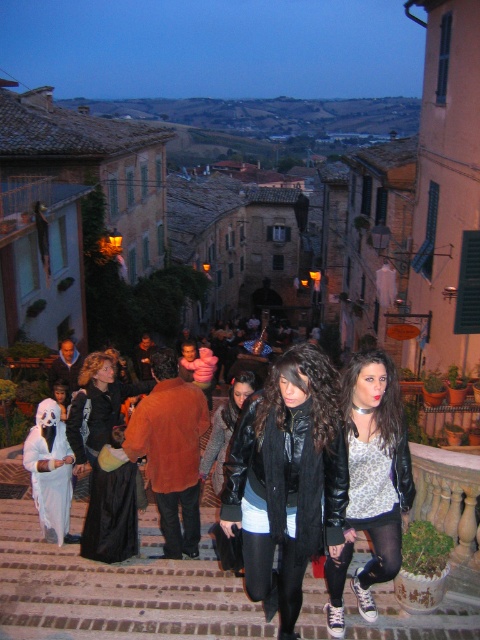
You are a costume designer observing the scene. You need to determine which object is wider between the white matte ghost at left and the black leather jacket at center. Can you compare their widths?

The white matte ghost at left is wider than the black leather jacket at center.

You are standing at the entrance of the cobblestone street and want to find the brown brick stairs at center. According to the coordinates provided, in which direction should you move to reach them?

The brown brick stairs at center is located at coordinates point (118, 588). Since the x and y coordinates are both greater than 0.5, you should move towards the upper right direction to reach them.

You are a photographer trying to capture a clear shot of both the white matte ghost at left and the black leather jacket at center. Since you want to ensure both are in focus, you need to know which object is taller. Can you tell me which one is taller?

The white matte ghost at left is taller than the black leather jacket at center, so you should adjust your camera settings to accommodate the height difference for better focus.